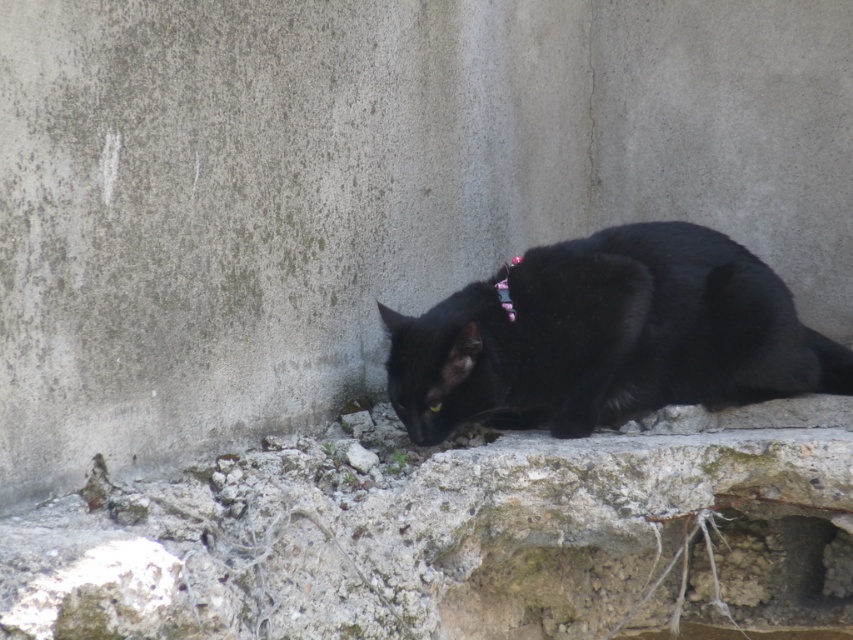
Question: Considering the relative positions of black fur cat at lower right and pink fabric neckband at center in the image provided, where is black fur cat at lower right located with respect to pink fabric neckband at center?

Choices:
 (A) right
 (B) left

Answer: (A)

Question: Which point is farther from the camera taking this photo?

Choices:
 (A) (296, 547)
 (B) (521, 360)
 (C) (506, 285)

Answer: (C)

Question: Which object is closer to the camera taking this photo?

Choices:
 (A) pink fabric neckband at center
 (B) rough concrete wall at lower center

Answer: (B)

Question: Is black fur cat at lower right further to camera compared to pink fabric neckband at center?

Choices:
 (A) no
 (B) yes

Answer: (A)

Question: Does rough concrete wall at lower center lie in front of pink fabric neckband at center?

Choices:
 (A) no
 (B) yes

Answer: (B)

Question: Which of the following is the closest to the observer?

Choices:
 (A) (791, 332)
 (B) (512, 304)

Answer: (B)